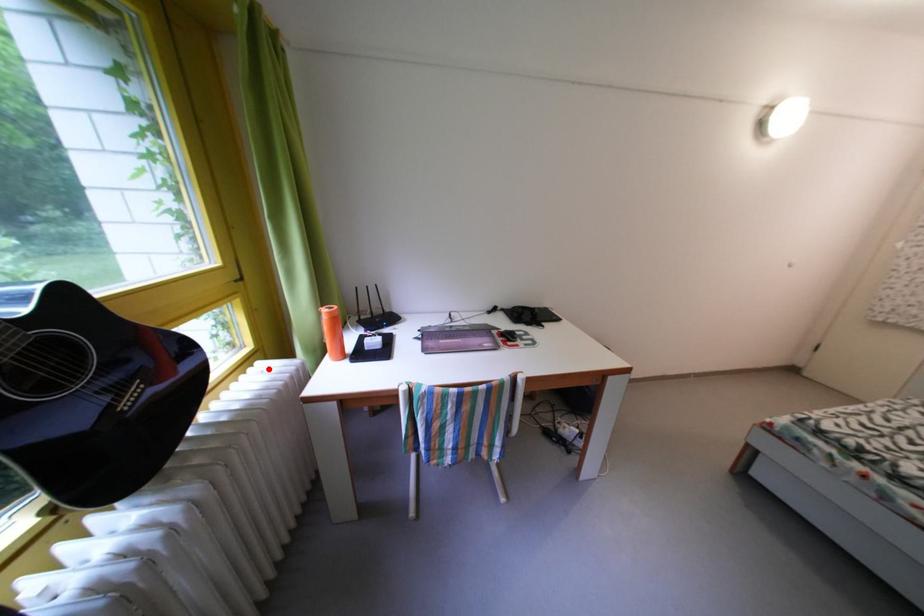
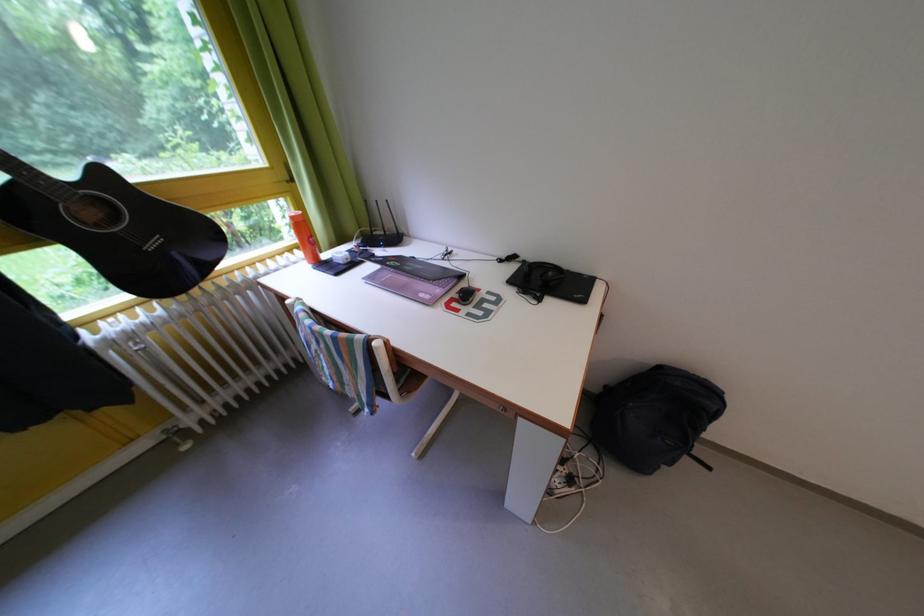
Question: I am providing you with two images of the same scene from different viewpoints. In image1, a red point is highlighted. Considering the same 3D point in image2, which of the following is correct?

Choices:
 (A) It is closer
 (B) It is farther

Answer: (B)